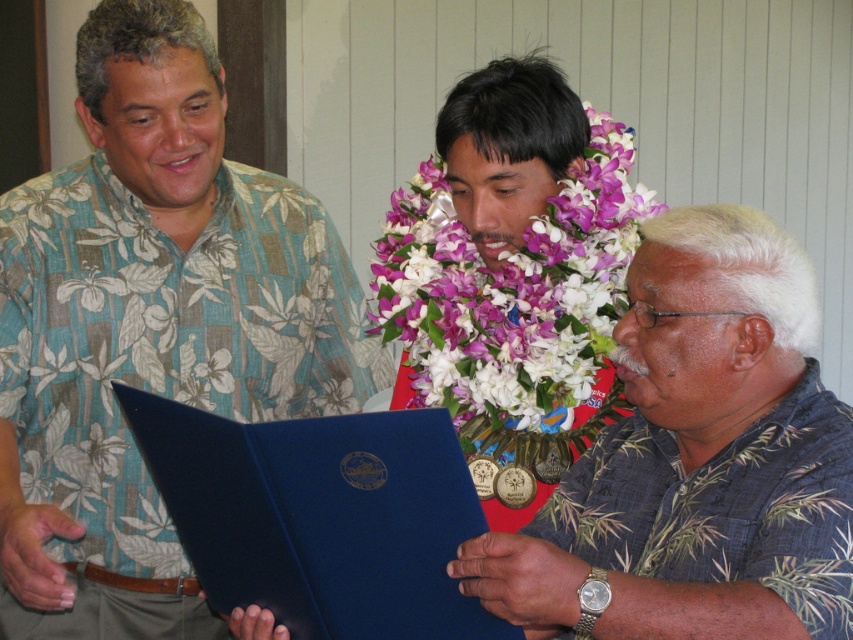
Question: Is floral print shirt at left wider than blue fabric folder at center?

Choices:
 (A) no
 (B) yes

Answer: (B)

Question: Which of the following is the closest to the observer?

Choices:
 (A) (410, 534)
 (B) (595, 220)

Answer: (A)

Question: Which object appears closest to the camera in this image?

Choices:
 (A) blue fabric folder at center
 (B) purple fabric lei at center
 (C) blue leather book at center
 (D) floral print shirt at left

Answer: (A)

Question: Does blue fabric folder at center appear under purple fabric lei at center?

Choices:
 (A) no
 (B) yes

Answer: (B)

Question: Is floral print shirt at left smaller than blue leather book at center?

Choices:
 (A) yes
 (B) no

Answer: (B)

Question: Based on their relative distances, which object is farther from the blue leather book at center?

Choices:
 (A) blue fabric folder at center
 (B) floral print shirt at left
 (C) purple fabric lei at center

Answer: (C)